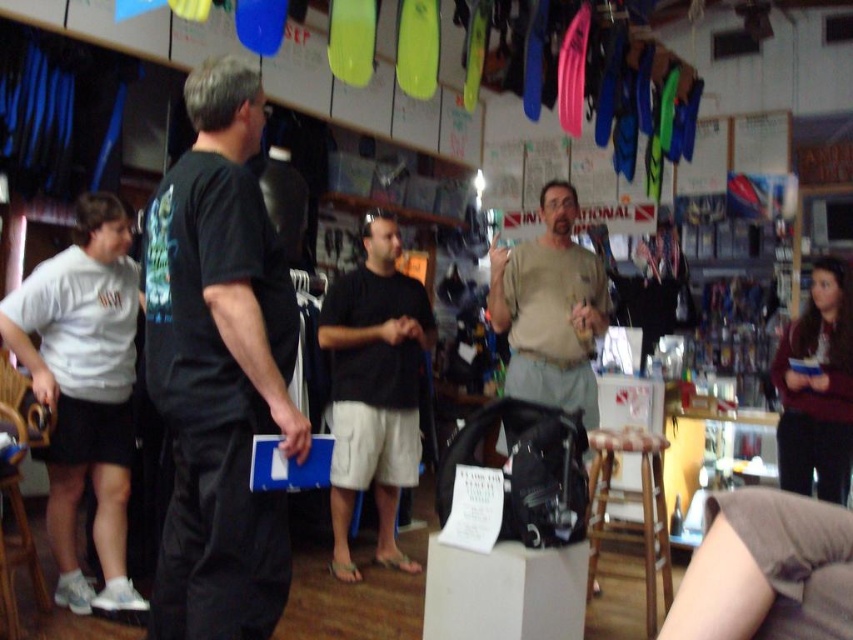
Question: Can you confirm if light brown cotton shirt at center is wider than wooden stool at lower right?

Choices:
 (A) yes
 (B) no

Answer: (B)

Question: Is black matte t-shirt at left to the right of wooden stool at lower right from the viewer's perspective?

Choices:
 (A) no
 (B) yes

Answer: (A)

Question: Can you confirm if white cotton shirt at left is smaller than black matte shorts at center?

Choices:
 (A) yes
 (B) no

Answer: (A)

Question: Which object appears closest to the camera in this image?

Choices:
 (A) light brown cotton shirt at center
 (B) wooden stool at lower right

Answer: (B)

Question: Among these objects, which one is farthest from the camera?

Choices:
 (A) black matte shorts at center
 (B) light brown cotton shirt at center
 (C) white cotton shirt at left
 (D) wooden stool at lower right

Answer: (A)

Question: Based on their relative distances, which object is farther from the white cotton shirt at left?

Choices:
 (A) black matte shorts at center
 (B) light brown cotton shirt at center
 (C) black matte t-shirt at left

Answer: (B)